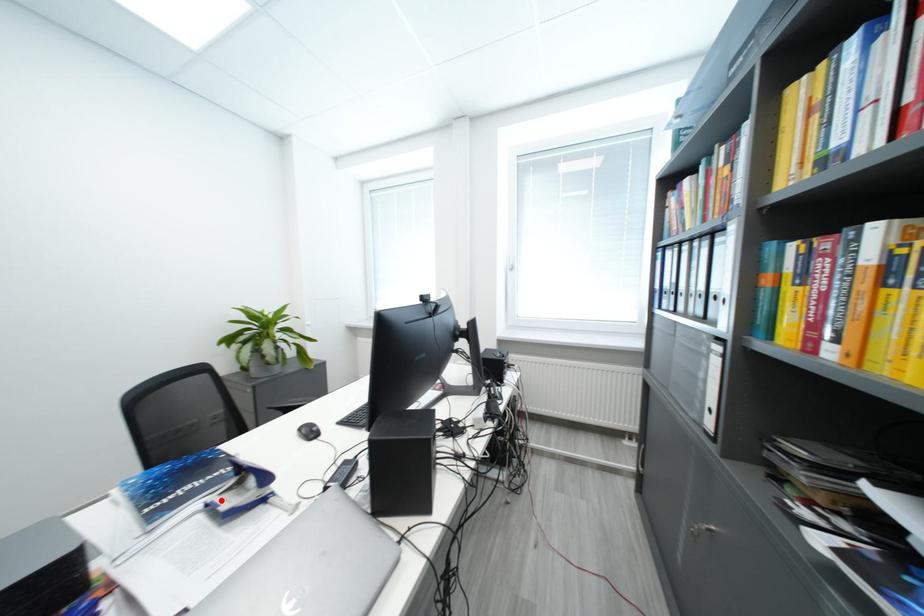
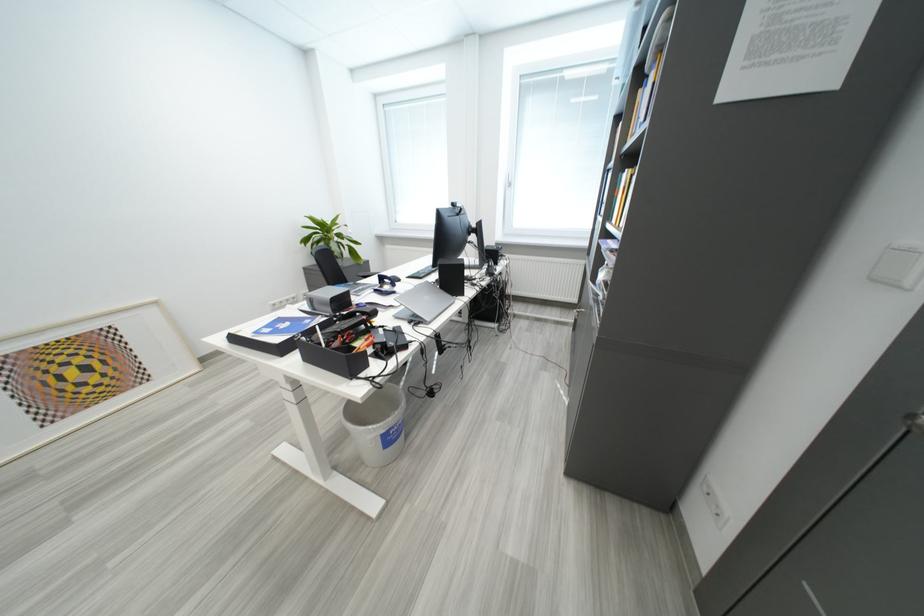
The point at the highlighted location is marked in the first image. Where is the corresponding point in the second image?

(384, 291)